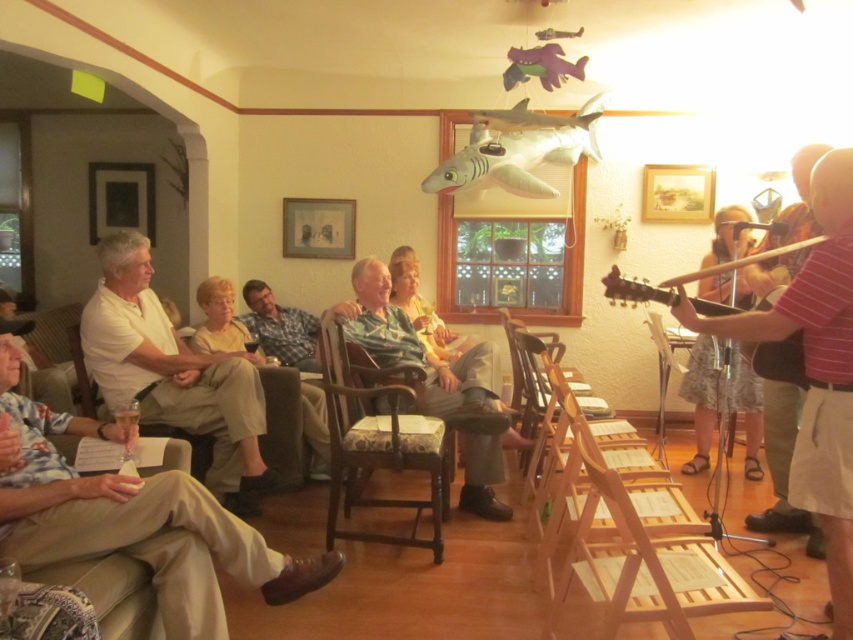
You are organizing a small event and need to place a decorative item on a table. You have the khaki cotton pants at center and the black matte picture frame at upper left. Which item can you place without needing to adjust the table space due to its size?

The black matte picture frame at upper left can be placed without needing to adjust the table space because the khaki cotton pants at center has a larger size, making it less suitable for limited space.

You are a photographer at the event and want to take a clear photo of the light brown wood chair at center without any people blocking it. However, there is a person wearing the white cotton shirt at left sitting there. What should you ask the person to do?

Ask the person wearing the white cotton shirt at left to move off the light brown wood chair at center since the white cotton shirt at left is currently positioned over it, meaning the person is sitting on the chair.